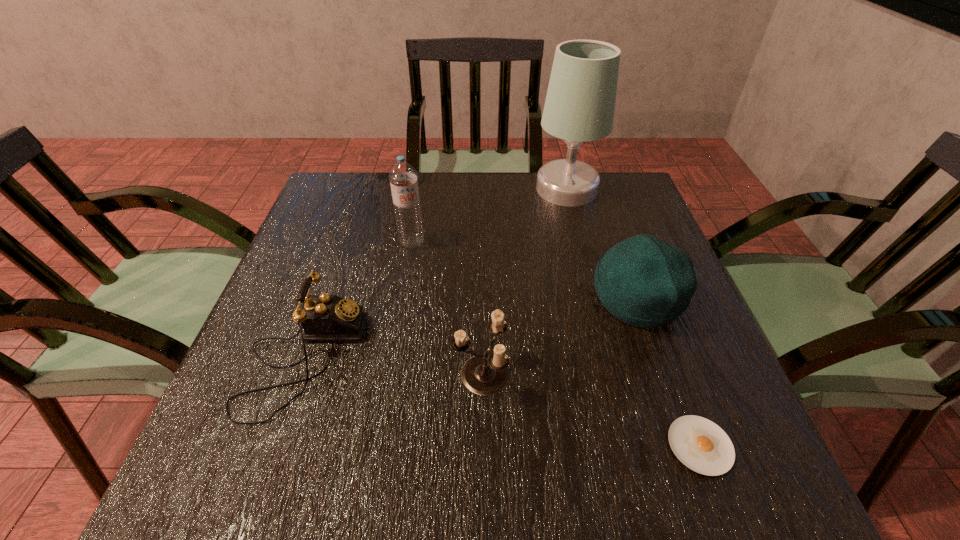
Where is `object that is the third closest to the candle holder`? The width and height of the screenshot is (960, 540). object that is the third closest to the candle holder is located at coordinates (700, 444).

At what (x,y) coordinates should I click in order to perform the action: click on vacant space that satisfies the following two spatial constraints: 1. on the dial of the third object from left to right; 2. on the left side of the telephone. Please return your answer as a coordinate pair (x, y). Looking at the image, I should click on (298, 374).

Image resolution: width=960 pixels, height=540 pixels. What are the coordinates of `free space that satisfies the following two spatial constraints: 1. on the back side of the beanie; 2. on the base of the lampshade` in the screenshot? It's located at [599, 189].

Identify the location of vacant space that satisfies the following two spatial constraints: 1. on the front side of the fifth nearest object; 2. on the right side of the beanie. The width and height of the screenshot is (960, 540). (402, 299).

Where is `free space that satisfies the following two spatial constraints: 1. on the back side of the shortest object; 2. on the base of the farthest object`? The height and width of the screenshot is (540, 960). free space that satisfies the following two spatial constraints: 1. on the back side of the shortest object; 2. on the base of the farthest object is located at coordinates (605, 189).

Find the location of a particular element. The image size is (960, 540). vacant area in the image that satisfies the following two spatial constraints: 1. on the dial of the telephone; 2. on the right side of the egg yolk is located at coordinates (273, 446).

You are a GUI agent. You are given a task and a screenshot of the screen. Output one action in this format:
    pyautogui.click(x=<x>, y=<y>)
    Task: Click on the vacant area that satisfies the following two spatial constraints: 1. on the base of the tallest object; 2. on the back side of the beanie
    The height and width of the screenshot is (540, 960).
    Given the screenshot: What is the action you would take?
    pyautogui.click(x=594, y=299)